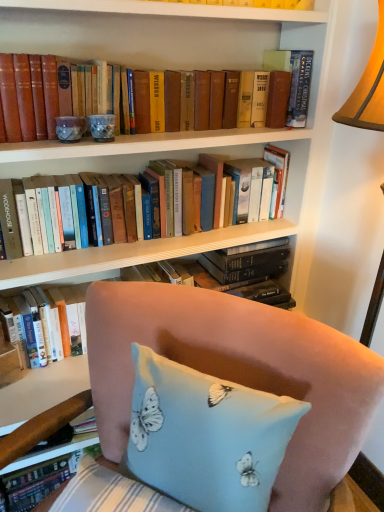
Question: Considering the relative sizes of hardcover books at center, marked as the 3th book in a top-to-bottom arrangement, and light blue fabric pillow with butterfly print at lower center in the image provided, is hardcover books at center, marked as the 3th book in a top-to-bottom arrangement, bigger than light blue fabric pillow with butterfly print at lower center?

Choices:
 (A) no
 (B) yes

Answer: (A)

Question: Is hardcover books at center, marked as the 3th book in a top-to-bottom arrangement, to the right of light blue fabric pillow with butterfly print at lower center from the viewer's perspective?

Choices:
 (A) no
 (B) yes

Answer: (A)

Question: From a real-world perspective, is hardcover books at center, which is the 1th book in bottom-to-top order, on light blue fabric pillow with butterfly print at lower center?

Choices:
 (A) no
 (B) yes

Answer: (B)

Question: Is hardcover books at center, marked as the 3th book in a top-to-bottom arrangement, oriented towards light blue fabric pillow with butterfly print at lower center?

Choices:
 (A) yes
 (B) no

Answer: (B)

Question: Is hardcover books at center, which is the 1th book in bottom-to-top order, with light blue fabric pillow with butterfly print at lower center?

Choices:
 (A) no
 (B) yes

Answer: (A)

Question: Is hardcover books at center, which is the 1th book in bottom-to-top order, thinner than light blue fabric pillow with butterfly print at lower center?

Choices:
 (A) no
 (B) yes

Answer: (B)

Question: From the image's perspective, is matte brown book at upper center, marked as the second book in a bottom-to-top arrangement, located above hardcover book at upper right, acting as the 1th book starting from the top?

Choices:
 (A) no
 (B) yes

Answer: (A)

Question: Does matte brown book at upper center, marked as the second book in a bottom-to-top arrangement, lie behind hardcover book at upper right, acting as the 1th book starting from the top?

Choices:
 (A) yes
 (B) no

Answer: (B)

Question: Is matte brown book at upper center, marked as the second book in a bottom-to-top arrangement, located outside hardcover book at upper right, the 3th book ordered from the bottom?

Choices:
 (A) no
 (B) yes

Answer: (B)

Question: Does matte brown book at upper center, marked as the second book in a bottom-to-top arrangement, turn towards hardcover book at upper right, acting as the 1th book starting from the top?

Choices:
 (A) yes
 (B) no

Answer: (B)

Question: From a real-world perspective, does matte brown book at upper center, the 2th book positioned from the top, stand above hardcover book at upper right, acting as the 1th book starting from the top?

Choices:
 (A) yes
 (B) no

Answer: (B)

Question: Can you confirm if matte brown book at upper center, the 2th book positioned from the top, is wider than hardcover book at upper right, the 3th book ordered from the bottom?

Choices:
 (A) no
 (B) yes

Answer: (A)

Question: Is light blue fabric pillow with butterfly print at lower center smaller than hardcover book at upper right, acting as the 1th book starting from the top?

Choices:
 (A) yes
 (B) no

Answer: (B)